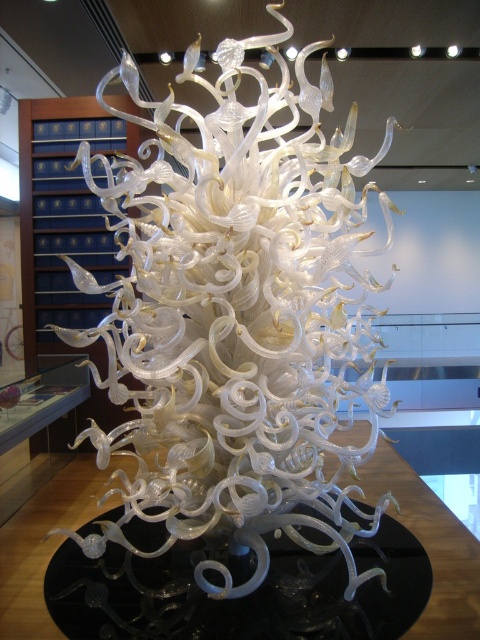
From the picture: Who is shorter, translucent glass sculpture at center or black glass table at center?

Standing shorter between the two is black glass table at center.

Which is behind, point (201, 330) or point (387, 586)?

Point (201, 330)

Between point (175, 372) and point (331, 563), which one is positioned behind?

Positioned behind is point (331, 563).

Locate an element on the screen. The width and height of the screenshot is (480, 640). translucent glass sculpture at center is located at coordinates (236, 314).